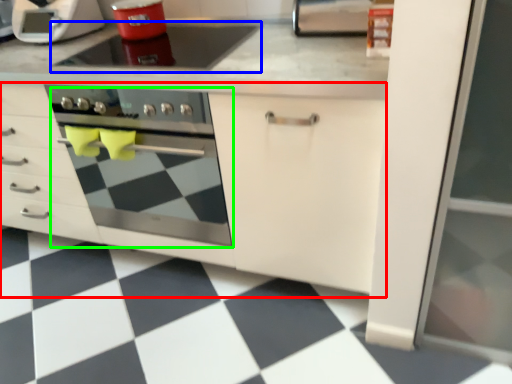
Question: Which is farther away from cabinetry (highlighted by a red box)? gas stove (highlighted by a blue box) or oven (highlighted by a green box)?

Choices:
 (A) gas stove
 (B) oven

Answer: (B)